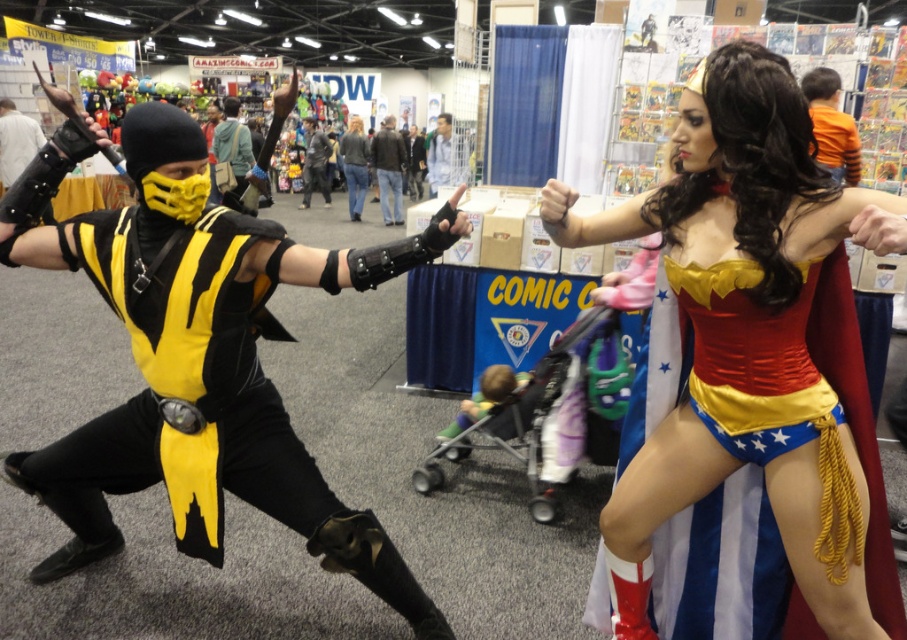
Question: Can you confirm if denim jeans at center is bigger than blue fabric shirt at center?

Choices:
 (A) no
 (B) yes

Answer: (A)

Question: Considering the real-world distances, which object is closest to the green fabric jacket at center?

Choices:
 (A) orange cotton shirt at upper right
 (B) denim jeans at center

Answer: (B)

Question: Does orange cotton shirt at upper right appear over blue fabric shirt at center?

Choices:
 (A) no
 (B) yes

Answer: (A)

Question: Can you confirm if denim jeans at center is bigger than dark gray fabric jacket at center?

Choices:
 (A) yes
 (B) no

Answer: (B)

Question: Which object appears closest to the camera in this image?

Choices:
 (A) shiny red fabric cape at right
 (B) green fabric jacket at center
 (C) denim jeans at center

Answer: (A)

Question: Considering the real-world distances, which object is closest to the dark gray fabric jacket at center?

Choices:
 (A) shiny red fabric cape at right
 (B) green fabric jacket at center
 (C) matte black vest at left

Answer: (B)